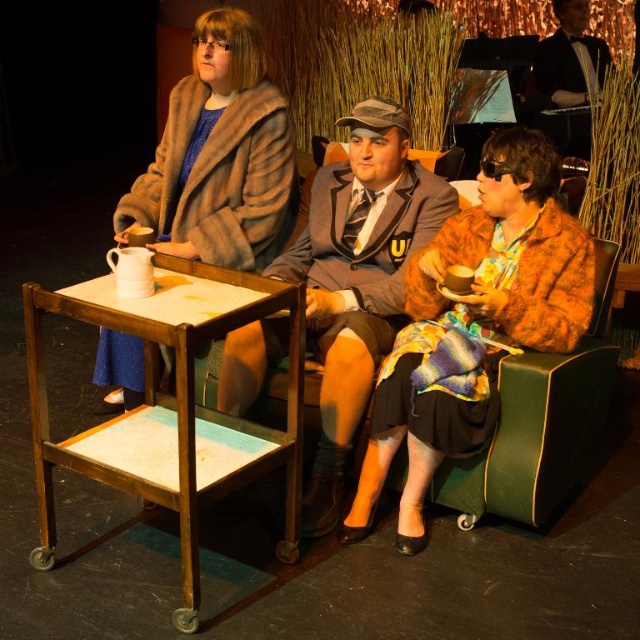
Question: Among these objects, which one is nearest to the camera?

Choices:
 (A) fur coat at upper left
 (B) matte gray suit at center

Answer: (B)

Question: From the image, what is the correct spatial relationship of matte gray suit at center in relation to velvet green armchair at right?

Choices:
 (A) right
 (B) left

Answer: (B)

Question: Does brown wooden table at center appear on the left side of matte gray suit at center?

Choices:
 (A) no
 (B) yes

Answer: (B)

Question: Estimate the real-world distances between objects in this image. Which object is closer to the matte gray suit at center?

Choices:
 (A) velvet green armchair at right
 (B) brown wooden table at center
 (C) fur coat at upper left

Answer: (C)

Question: Is brown wooden table at center below fur coat at upper left?

Choices:
 (A) no
 (B) yes

Answer: (B)

Question: Which of these objects is positioned farthest from the fur coat at upper left?

Choices:
 (A) velvet green armchair at right
 (B) brown wooden table at center

Answer: (A)